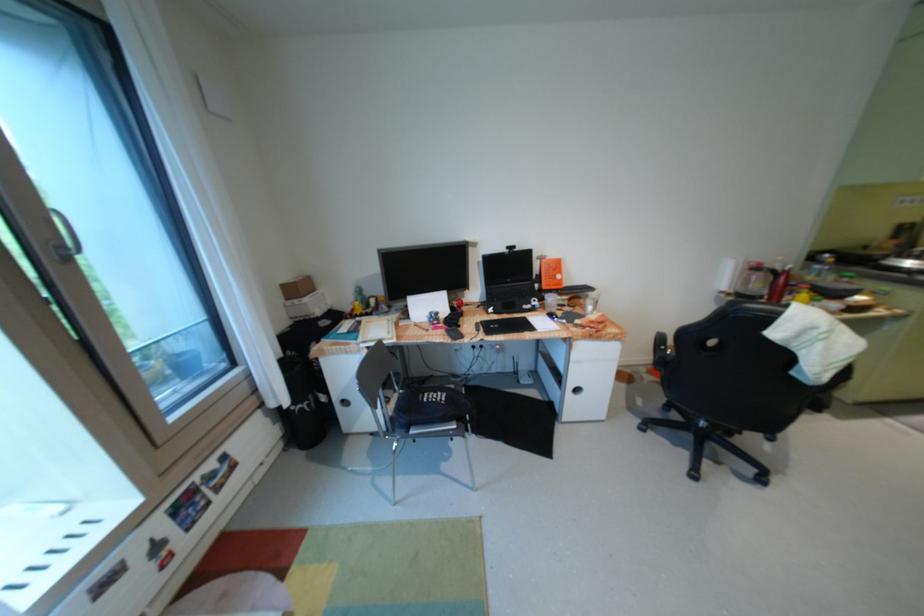
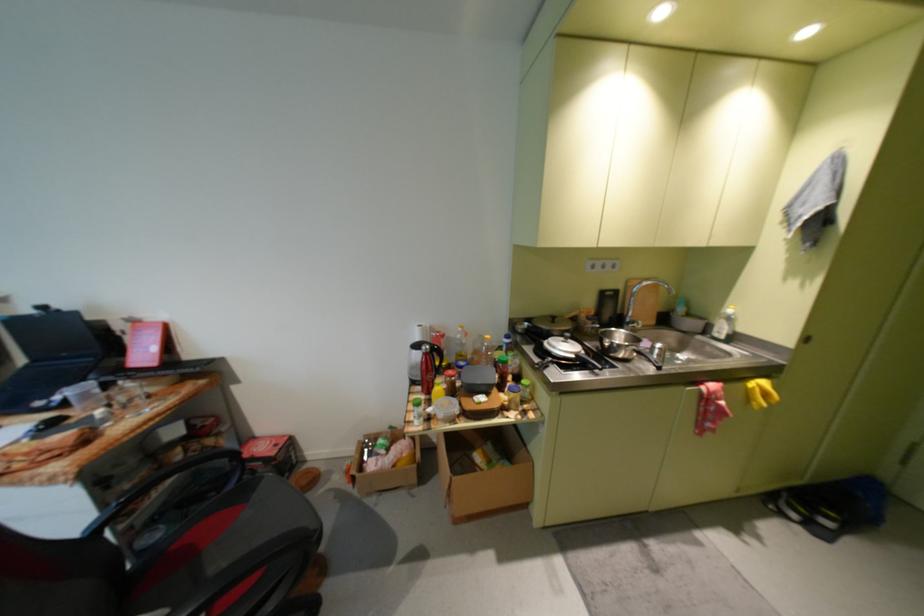
Question: In a continuous first-person perspective shot, in which direction is the camera moving?

Choices:
 (A) Left
 (B) Right
 (C) Forward
 (D) Backward

Answer: (B)